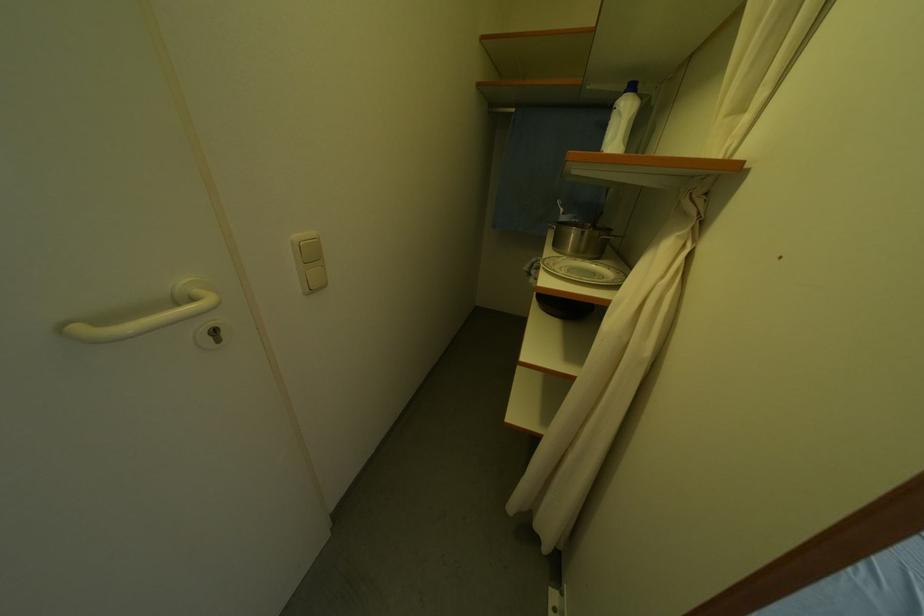
Where is `metal cooking pot`? The height and width of the screenshot is (616, 924). metal cooking pot is located at coordinates (580, 238).